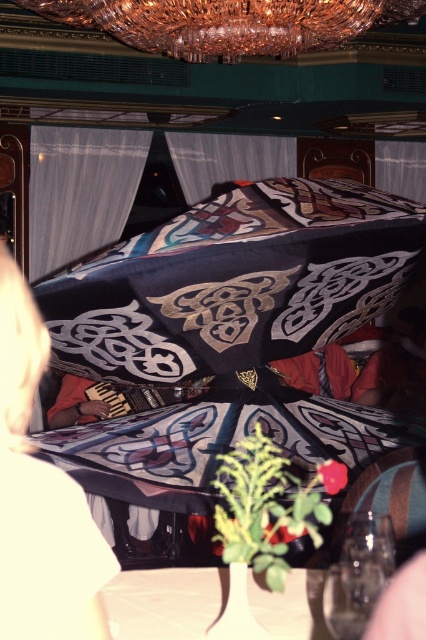
You are standing at the entrance of the restaurant and want to sit down on the velvet fabric couch at center. Which direction should you walk to reach it?

The velvet fabric couch at center is located at point (40, 499), so you should walk towards the center of the room to reach it.

You are a stage designer preparing to install a new curtain in the restaurant. You have two options from the image, the white sheer curtain at left and the silky gray curtain at center. Which curtain should you choose if you want one that reaches higher up the wall?

The white sheer curtain at left is much taller than the silky gray curtain at center, so you should choose the white sheer curtain at left to reach higher up the wall.

You are a guest at this restaurant and want to take a photo of the silky black umbrella at center and the crystal glass chandelier at upper center. Can you frame both in a single shot without moving your position? Explain why or why not based on their positions.

The silky black umbrella at center is closer to the viewer than the crystal glass chandelier at upper center. Since the umbrella is closer, it may block part of the chandelier if they are along the same line of sight. However, if you adjust your angle slightly, you might capture both in the frame as they are positioned at different vertical levels. Alternatively, using a wider lens could help include both in the shot without moving.